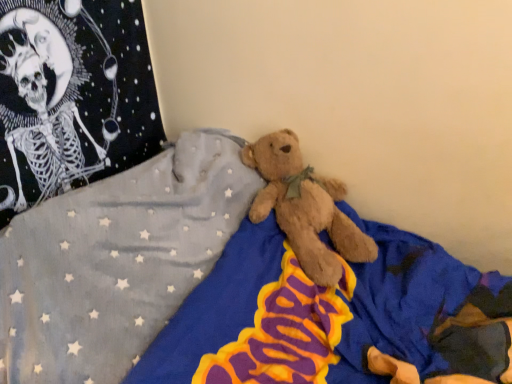
Question: Is fuzzy brown teddy bear at upper left taller or shorter than soft plush bear at center?

Choices:
 (A) short
 (B) tall

Answer: (A)

Question: From a real-world perspective, relative to soft plush bear at center, is fuzzy brown teddy bear at upper left vertically above or below?

Choices:
 (A) below
 (B) above

Answer: (B)

Question: Is fuzzy brown teddy bear at upper left in front of or behind soft plush bear at center in the image?

Choices:
 (A) behind
 (B) front

Answer: (A)

Question: Considering the positions of soft plush bear at center and fuzzy brown teddy bear at upper left in the image, is soft plush bear at center bigger or smaller than fuzzy brown teddy bear at upper left?

Choices:
 (A) small
 (B) big

Answer: (B)

Question: Visually, is soft plush bear at center positioned to the left or to the right of fuzzy brown teddy bear at upper left?

Choices:
 (A) left
 (B) right

Answer: (B)

Question: Considering the positions of soft plush bear at center and fuzzy brown teddy bear at upper left in the image, is soft plush bear at center wider or thinner than fuzzy brown teddy bear at upper left?

Choices:
 (A) thin
 (B) wide

Answer: (B)

Question: From a real-world perspective, is soft plush bear at center above or below fuzzy brown teddy bear at upper left?

Choices:
 (A) below
 (B) above

Answer: (A)